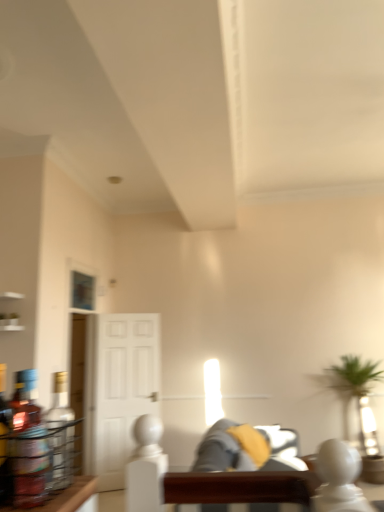
Question: From the image's perspective, is translucent glass bottle at left, the second bottle in the front-to-back sequence, located above or below gray fabric couch at center, arranged as the 2th couch when viewed from the front?

Choices:
 (A) below
 (B) above

Answer: (B)

Question: Looking at the image, does translucent glass bottle at left, the second bottle in the front-to-back sequence, seem bigger or smaller compared to gray fabric couch at center, arranged as the 2th couch when viewed from the front?

Choices:
 (A) big
 (B) small

Answer: (B)

Question: Which object is the farthest from the translucent glass bottle at left, the second bottle in the front-to-back sequence?

Choices:
 (A) soft gray fabric couch at center, positioned as the second couch in back-to-front order
 (B) gray fabric couch at center, the 1th couch positioned from the back
 (C) translucent glass bottle at left, marked as the second bottle in a back-to-front arrangement
 (D) white glossy door at center

Answer: (B)

Question: Which is farther from the soft gray fabric couch at center, the 1th couch in the front-to-back sequence?

Choices:
 (A) gray fabric couch at center, the 1th couch positioned from the back
 (B) translucent glass bottle at left, the second bottle in the front-to-back sequence
 (C) translucent glass bottle at left, placed as the 1th bottle when sorted from front to back
 (D) white glossy door at center

Answer: (C)